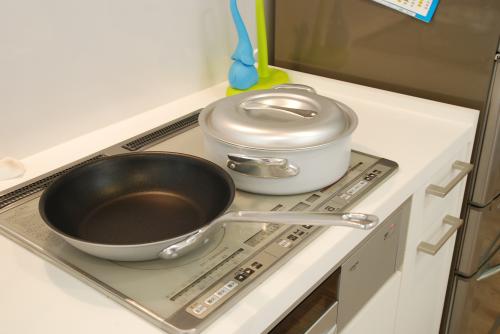
Where is `stove top`? stove top is located at coordinates (203, 257), (263, 195).